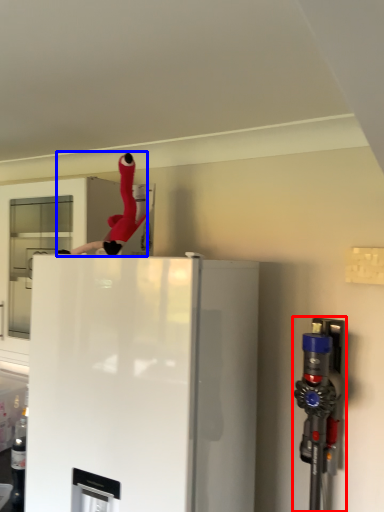
Question: Which object appears closest to the camera in this image, appliance (highlighted by a red box) or person (highlighted by a blue box)?

Choices:
 (A) appliance
 (B) person

Answer: (A)